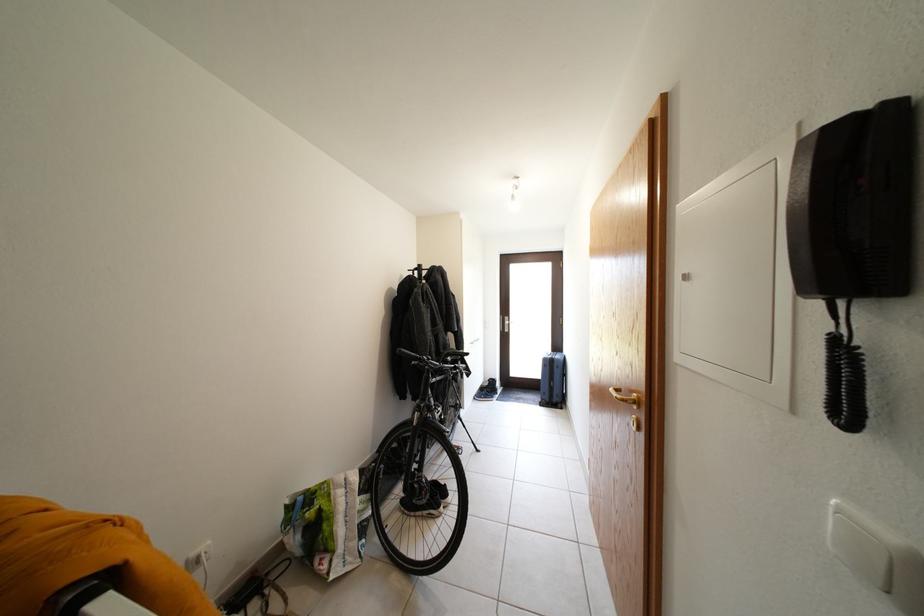
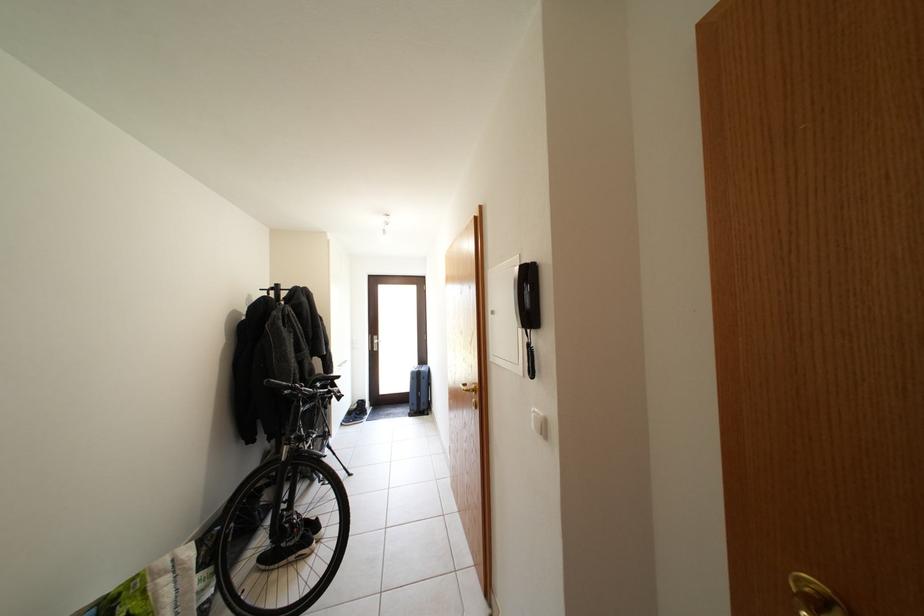
In the second image, find the point that corresponds to [553,365] in the first image.

(420, 379)